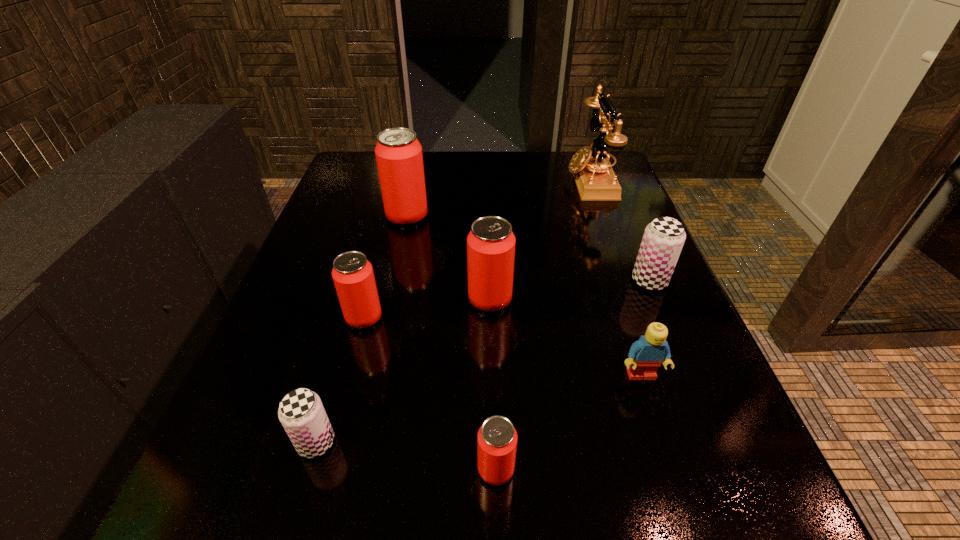
In order to click on the nearer purple beer can in this screenshot , I will do `click(301, 412)`.

At what (x,y) coordinates should I click in order to perform the action: click on the smaller purple beer can. Please return your answer as a coordinate pair (x, y). Image resolution: width=960 pixels, height=540 pixels. Looking at the image, I should click on (301, 412).

Locate an element on the screen. the smallest red beer can is located at coordinates (497, 438).

You are a GUI agent. You are given a task and a screenshot of the screen. Output one action in this format:
    pyautogui.click(x=<x>, y=<y>)
    Task: Click on the vacant point located 0.310m on the dial of the beige telephone
    
    Given the screenshot: What is the action you would take?
    (x=448, y=180)

Where is `vacant space located 0.290m on the dial of the beige telephone`? The image size is (960, 540). vacant space located 0.290m on the dial of the beige telephone is located at coordinates (456, 180).

Locate an element on the screen. vacant region located 0.380m on the dial of the beige telephone is located at coordinates (421, 180).

Identify the location of vacant space located 0.170m on the back of the farthest red beer can. (417, 171).

Find the location of `vacant position located 0.070m on the back of the fifth shortest beer can`. vacant position located 0.070m on the back of the fifth shortest beer can is located at coordinates (489, 261).

Locate an element on the screen. The image size is (960, 540). free spot located 0.370m on the left of the rightmost beer can is located at coordinates (443, 281).

Where is `vacant space positioned on the right of the second smallest red beer can`? This screenshot has width=960, height=540. vacant space positioned on the right of the second smallest red beer can is located at coordinates (561, 318).